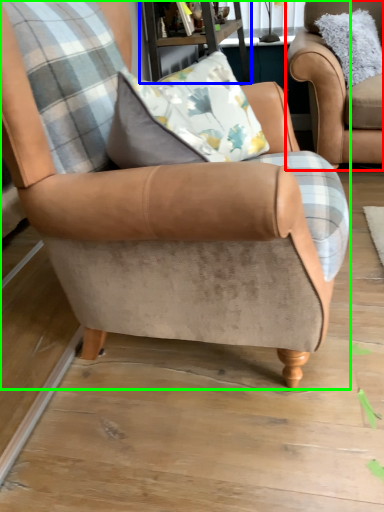
Question: Considering the real-world distances, which object is farthest from chair (highlighted by a red box)? table (highlighted by a blue box) or chair (highlighted by a green box)?

Choices:
 (A) table
 (B) chair

Answer: (B)